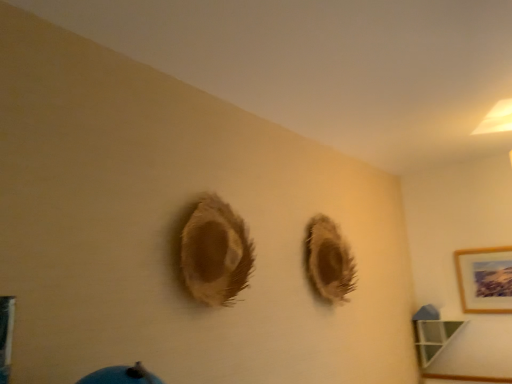
Question: Should I look upward or downward to see green glass shelf at lower right?

Choices:
 (A) down
 (B) up

Answer: (A)

Question: Does fuzzy brown hole at center have a greater height compared to green glass shelf at lower right?

Choices:
 (A) no
 (B) yes

Answer: (B)

Question: Considering the relative positions of fuzzy brown hole at center and green glass shelf at lower right in the image provided, is fuzzy brown hole at center to the left of green glass shelf at lower right from the viewer's perspective?

Choices:
 (A) no
 (B) yes

Answer: (B)

Question: Can you confirm if fuzzy brown hole at center is thinner than green glass shelf at lower right?

Choices:
 (A) no
 (B) yes

Answer: (B)

Question: Can you confirm if fuzzy brown hole at center is bigger than green glass shelf at lower right?

Choices:
 (A) no
 (B) yes

Answer: (B)

Question: From a real-world perspective, is fuzzy brown hole at center physically below green glass shelf at lower right?

Choices:
 (A) no
 (B) yes

Answer: (A)

Question: Is fuzzy brown hole at center far from green glass shelf at lower right?

Choices:
 (A) yes
 (B) no

Answer: (A)

Question: Can you confirm if wooden picture frame at upper right is taller than fuzzy brown hole at center?

Choices:
 (A) yes
 (B) no

Answer: (B)

Question: Is wooden picture frame at upper right oriented away from fuzzy brown hole at center?

Choices:
 (A) yes
 (B) no

Answer: (B)

Question: Is wooden picture frame at upper right bigger than fuzzy brown hole at center?

Choices:
 (A) yes
 (B) no

Answer: (B)

Question: Considering the relative positions of wooden picture frame at upper right and fuzzy brown hole at center in the image provided, is wooden picture frame at upper right behind fuzzy brown hole at center?

Choices:
 (A) yes
 (B) no

Answer: (A)

Question: Is wooden picture frame at upper right touching fuzzy brown hole at center?

Choices:
 (A) no
 (B) yes

Answer: (A)

Question: Is the depth of wooden picture frame at upper right less than that of fuzzy brown hole at center?

Choices:
 (A) yes
 (B) no

Answer: (B)

Question: Does green glass shelf at lower right have a lesser width compared to wooden picture frame at upper right?

Choices:
 (A) no
 (B) yes

Answer: (A)